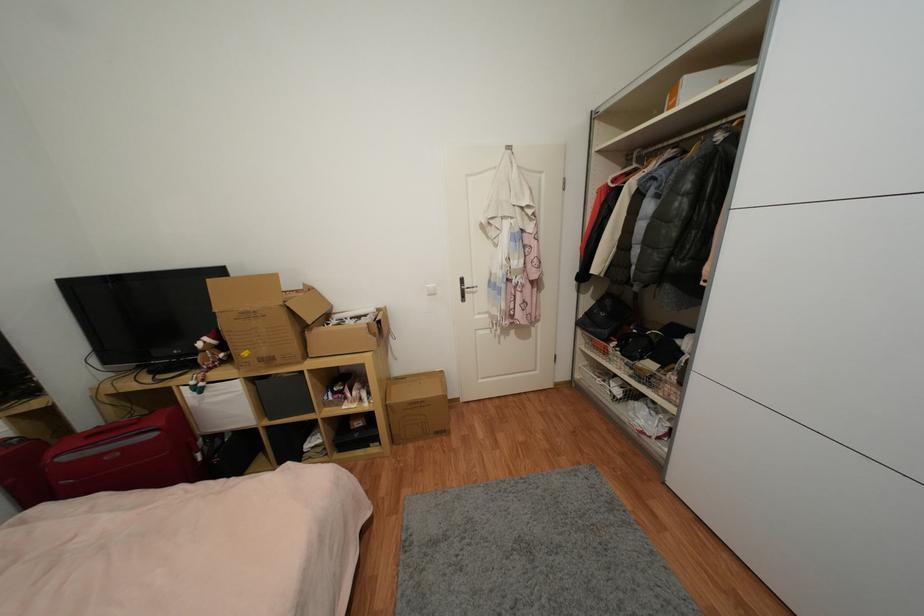
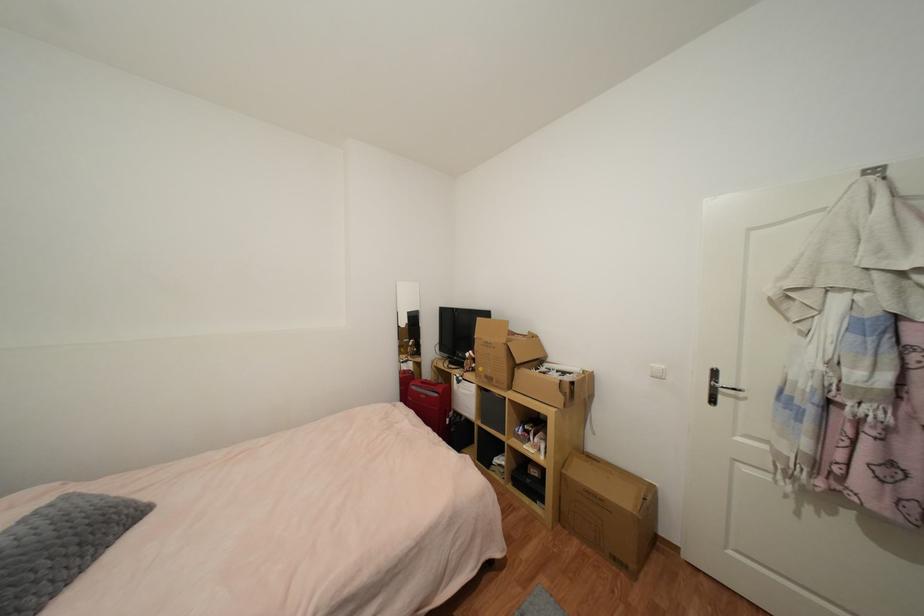
Locate, in the second image, the point that corresponds to point 436,294 in the first image.

(663, 378)